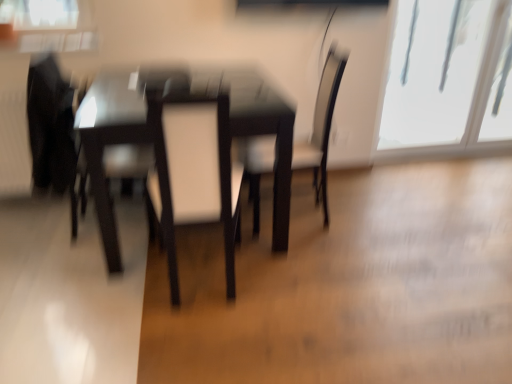
The image size is (512, 384). I want to click on free space to the right of white leather swivel chair at center, marked as the 2th swivel chair in a left-to-right arrangement, so click(288, 284).